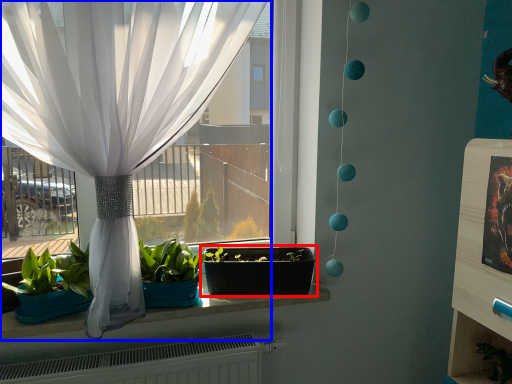
Question: Among these objects, which one is nearest to the camera, flowerpot (highlighted by a red box) or curtain (highlighted by a blue box)?

Choices:
 (A) flowerpot
 (B) curtain

Answer: (B)